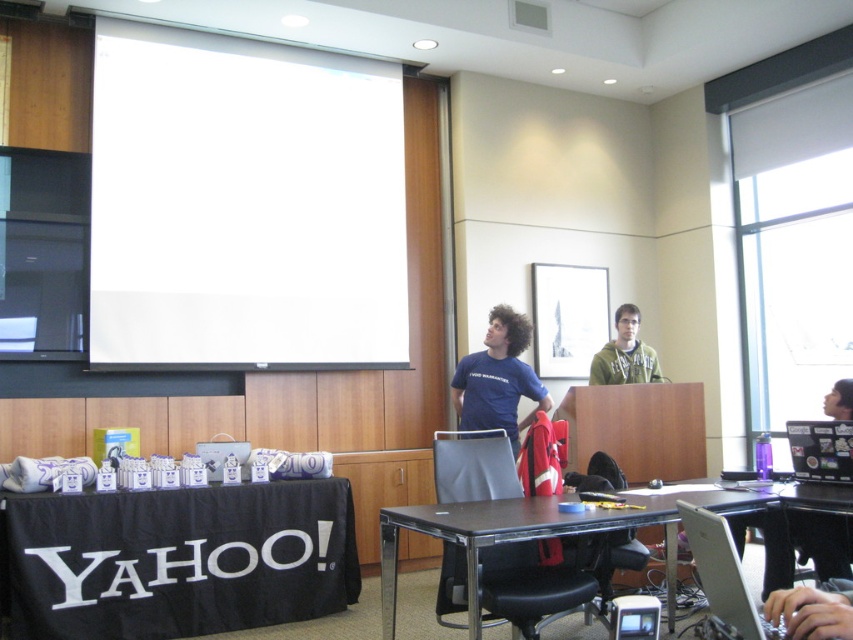
Does black fabric table at lower left have a greater height compared to black glossy laptop at lower right?

Indeed, black fabric table at lower left has a greater height compared to black glossy laptop at lower right.

This screenshot has height=640, width=853. What do you see at coordinates (177, 560) in the screenshot? I see `black fabric table at lower left` at bounding box center [177, 560].

I want to click on black fabric table at lower left, so click(177, 560).

The width and height of the screenshot is (853, 640). What do you see at coordinates (498, 378) in the screenshot?
I see `blue cotton shirt at center` at bounding box center [498, 378].

Is point (514, 376) closer to viewer compared to point (817, 538)?

No, it is not.

This screenshot has height=640, width=853. I want to click on blue cotton shirt at center, so click(498, 378).

Can you confirm if white matte projection screen at upper center is shorter than green hoodie at center?

No, white matte projection screen at upper center is not shorter than green hoodie at center.

From the picture: Does white matte projection screen at upper center have a greater height compared to green hoodie at center?

Correct, white matte projection screen at upper center is much taller as green hoodie at center.

Is point (311, 248) positioned after point (643, 369)?

Yes, point (311, 248) is farther from viewer.

What are the coordinates of `white matte projection screen at upper center` in the screenshot? It's located at (244, 204).